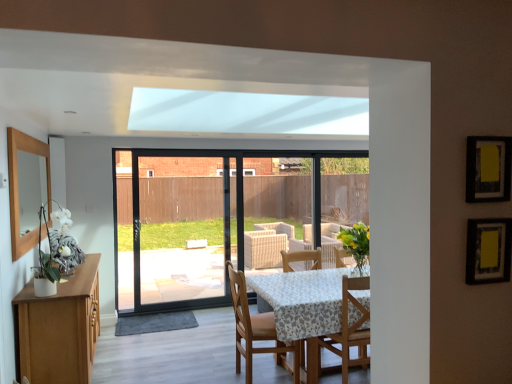
Question: Is wooden chair at center, placed as the 1th chair when sorted from right to left, taller or shorter than wooden chair at center, the 1th chair viewed from the left?

Choices:
 (A) short
 (B) tall

Answer: (A)

Question: Is wooden chair at center, placed as the 1th chair when sorted from right to left, wider or thinner than wooden chair at center, the 1th chair viewed from the left?

Choices:
 (A) wide
 (B) thin

Answer: (B)

Question: From the image's perspective, is wooden chair at center, placed as the 1th chair when sorted from right to left, located above or below wooden chair at center, the 1th chair viewed from the left?

Choices:
 (A) below
 (B) above

Answer: (B)

Question: Does point (263, 317) appear closer or farther from the camera than point (369, 337)?

Choices:
 (A) closer
 (B) farther

Answer: (B)

Question: Is wooden chair at center, the 1th chair viewed from the left, spatially inside wooden chair at center, which is counted as the second chair, starting from the left, or outside of it?

Choices:
 (A) inside
 (B) outside

Answer: (B)

Question: Based on their sizes in the image, would you say wooden chair at center, the 1th chair viewed from the left, is bigger or smaller than wooden chair at center, which is counted as the second chair, starting from the left?

Choices:
 (A) small
 (B) big

Answer: (B)

Question: In terms of width, does wooden chair at center, the 2th chair positioned from the right, look wider or thinner when compared to wooden chair at center, which is counted as the second chair, starting from the left?

Choices:
 (A) wide
 (B) thin

Answer: (A)